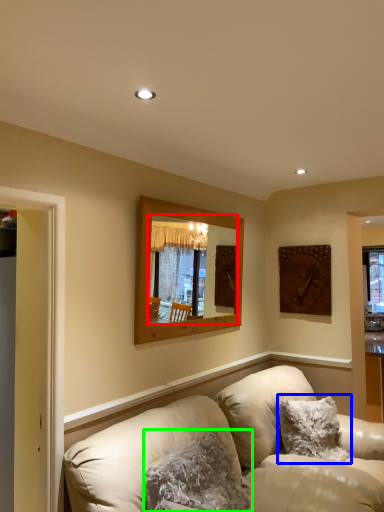
Question: Which object is the closest to the mirror (highlighted by a red box)? Choose among these: pillow (highlighted by a blue box) or pillow (highlighted by a green box).

Choices:
 (A) pillow
 (B) pillow

Answer: (A)